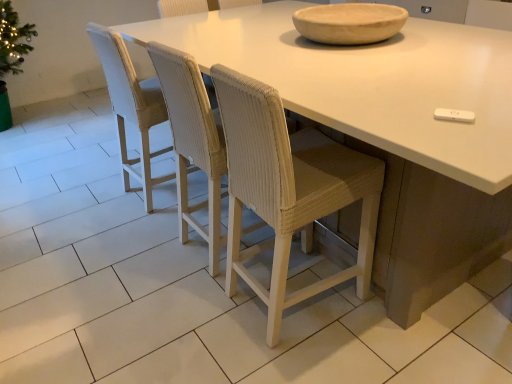
Question: Which direction should I rotate to look at white woven chair at center, which appears as the 1th chair when viewed from the right, — up or down?

Choices:
 (A) up
 (B) down

Answer: (A)

Question: Is white matte table at center at the right side of white woven chair at center, which appears as the 1th chair when viewed from the right?

Choices:
 (A) yes
 (B) no

Answer: (B)

Question: From the image's perspective, does white matte table at center appear higher than white woven chair at center, which appears as the 1th chair when viewed from the right?

Choices:
 (A) no
 (B) yes

Answer: (A)

Question: From a real-world perspective, is white matte table at center physically below white woven chair at center, the fourth chair from the left?

Choices:
 (A) no
 (B) yes

Answer: (B)

Question: Is white matte table at center positioned with its back to white woven chair at center, the fourth chair from the left?

Choices:
 (A) yes
 (B) no

Answer: (A)

Question: Does white matte table at center appear on the left side of white woven chair at center, the fourth chair from the left?

Choices:
 (A) yes
 (B) no

Answer: (A)

Question: Can you confirm if white matte table at center is thinner than white woven chair at center, which appears as the 1th chair when viewed from the right?

Choices:
 (A) no
 (B) yes

Answer: (A)

Question: Is woven white chair at center, which ranks as the third chair in left-to-right order, in front of white matte table at center?

Choices:
 (A) no
 (B) yes

Answer: (A)

Question: Is white matte table at center completely or partially inside woven white chair at center, marked as the second chair in a right-to-left arrangement?

Choices:
 (A) yes
 (B) no

Answer: (B)

Question: From the image's perspective, is woven white chair at center, which ranks as the third chair in left-to-right order, above white matte table at center?

Choices:
 (A) yes
 (B) no

Answer: (B)

Question: Considering the relative sizes of woven white chair at center, marked as the second chair in a right-to-left arrangement, and white matte table at center in the image provided, is woven white chair at center, marked as the second chair in a right-to-left arrangement, wider than white matte table at center?

Choices:
 (A) no
 (B) yes

Answer: (A)

Question: Considering the relative sizes of woven white chair at center, marked as the second chair in a right-to-left arrangement, and white matte table at center in the image provided, is woven white chair at center, marked as the second chair in a right-to-left arrangement, bigger than white matte table at center?

Choices:
 (A) yes
 (B) no

Answer: (B)

Question: Can you confirm if woven white chair at center, marked as the second chair in a right-to-left arrangement, is taller than white matte table at center?

Choices:
 (A) yes
 (B) no

Answer: (A)

Question: Does woven white chair at left, which is the 1th chair in left-to-right order, lie behind white woven chair at center, the fourth chair from the left?

Choices:
 (A) yes
 (B) no

Answer: (B)